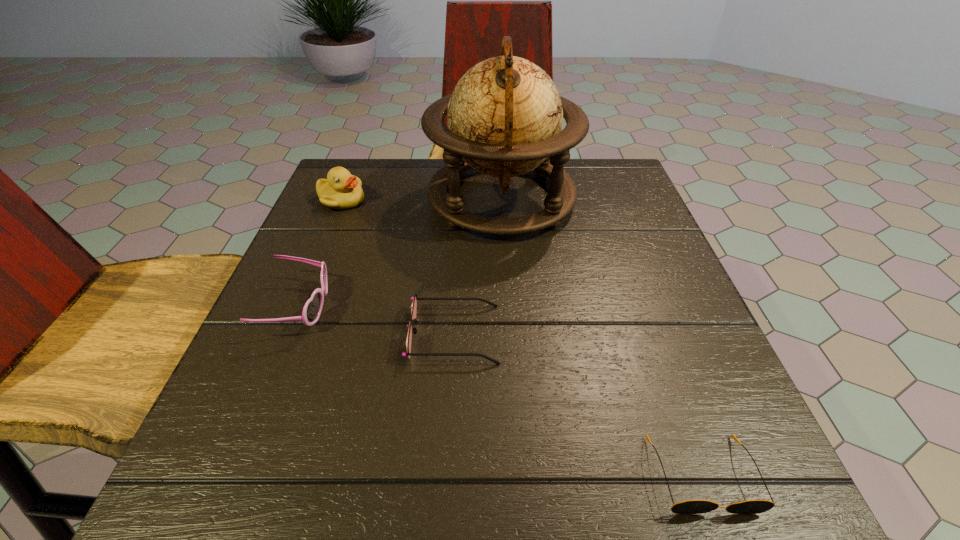
The height and width of the screenshot is (540, 960). Identify the location of free region located on the bridge of the second sunglasses from right to left. (650, 334).

Identify the location of globe present at the far edge. The height and width of the screenshot is (540, 960). (505, 115).

Where is `duckling at the far edge`? The width and height of the screenshot is (960, 540). duckling at the far edge is located at coordinates (341, 190).

Where is `object located in the near edge section of the desktop`? object located in the near edge section of the desktop is located at coordinates (690, 506).

Where is `duckling located at the left edge`? The image size is (960, 540). duckling located at the left edge is located at coordinates (341, 190).

What are the coordinates of `sunglasses present at the left edge` in the screenshot? It's located at (311, 312).

Find the location of a particular element. Image resolution: width=960 pixels, height=540 pixels. globe situated at the right edge is located at coordinates (505, 115).

The width and height of the screenshot is (960, 540). I want to click on sunglasses that is at the right edge, so tap(690, 506).

At what (x,y) coordinates should I click in order to perform the action: click on object that is at the far left corner. Please return your answer as a coordinate pair (x, y). This screenshot has height=540, width=960. Looking at the image, I should click on (341, 190).

At what (x,y) coordinates should I click in order to perform the action: click on object that is at the far right corner. Please return your answer as a coordinate pair (x, y). Image resolution: width=960 pixels, height=540 pixels. Looking at the image, I should click on (505, 115).